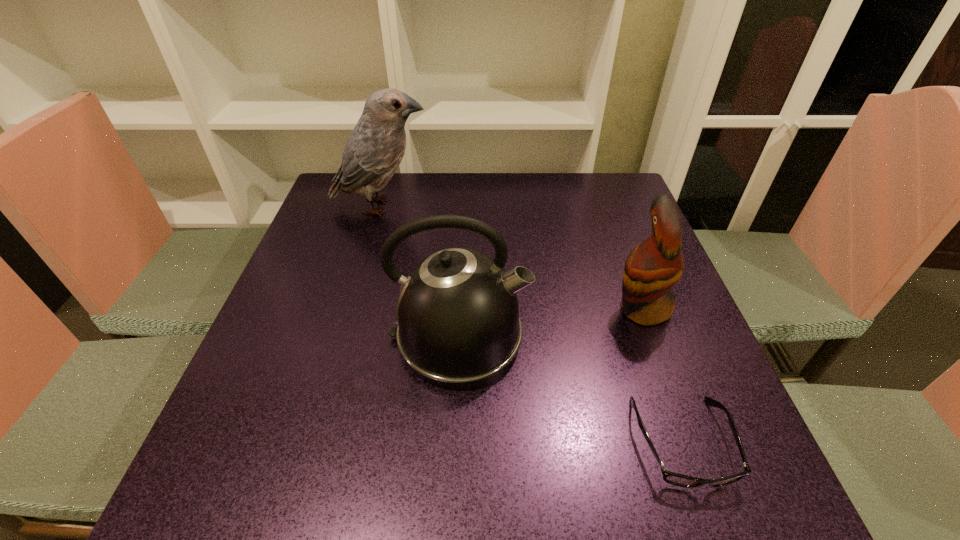
At what (x,y) coordinates should I click in order to perform the action: click on blank space at the near edge. Please return your answer as a coordinate pair (x, y). Looking at the image, I should click on (423, 469).

Find the location of a particular element. The image size is (960, 540). vacant space at the left edge is located at coordinates (326, 244).

What are the coordinates of `blank space at the right edge of the desktop` in the screenshot? It's located at (612, 274).

This screenshot has height=540, width=960. Identify the location of free spot at the near right corner of the desktop. (757, 475).

Image resolution: width=960 pixels, height=540 pixels. Identify the location of empty location between the kettle and the shorter parrot. (550, 323).

What are the coordinates of `free spot between the nearest object and the kettle` in the screenshot? It's located at (570, 390).

Locate an element on the screen. The width and height of the screenshot is (960, 540). free point between the shorter parrot and the kettle is located at coordinates (550, 323).

The height and width of the screenshot is (540, 960). Identify the location of vacant space that's between the farthest object and the spectacles. (532, 324).

Identify the location of unoccupied area between the kettle and the spectacles. (570, 390).

Where is `free area in between the taller parrot and the shortest object`? free area in between the taller parrot and the shortest object is located at coordinates (532, 324).